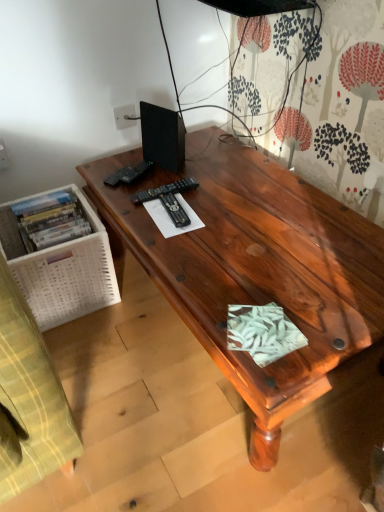
This screenshot has width=384, height=512. I want to click on free spot to the left of black matte speaker at upper left, so click(120, 166).